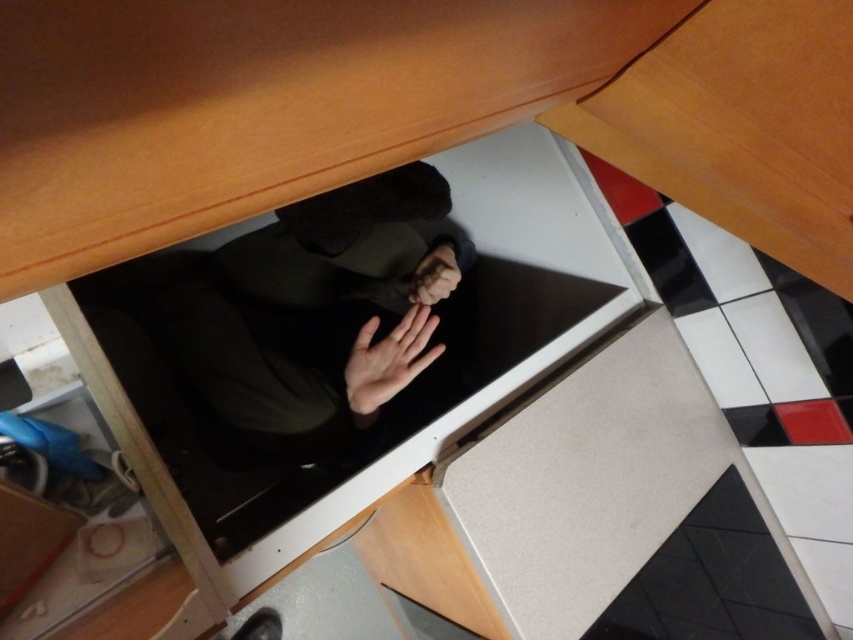
Question: Can you confirm if smooth skin hand at center is wider than matte black hand at center?

Choices:
 (A) yes
 (B) no

Answer: (A)

Question: Among these objects, which one is nearest to the camera?

Choices:
 (A) black matte laptop at center
 (B) matte black hand at center

Answer: (A)

Question: Based on their relative distances, which object is farther from the black matte laptop at center?

Choices:
 (A) smooth skin hand at center
 (B) matte black hand at center

Answer: (B)

Question: Estimate the real-world distances between objects in this image. Which object is farther from the matte black hand at center?

Choices:
 (A) smooth skin hand at center
 (B) black matte laptop at center

Answer: (B)

Question: From the image, what is the correct spatial relationship of smooth skin hand at center in relation to matte black hand at center?

Choices:
 (A) left
 (B) right

Answer: (A)

Question: Is black matte laptop at center in front of matte black hand at center?

Choices:
 (A) yes
 (B) no

Answer: (A)